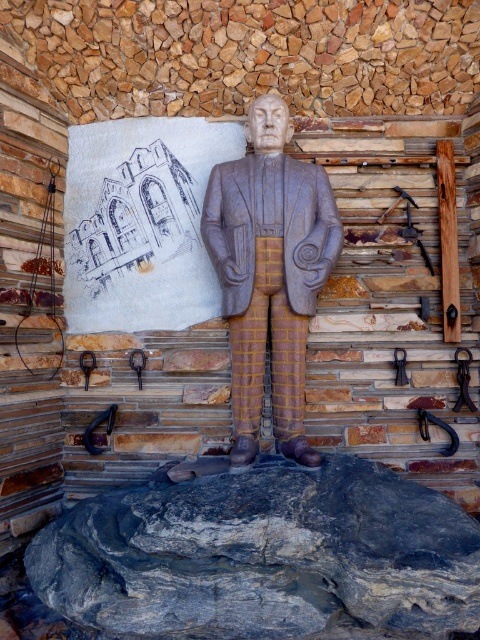
You are an art restorer examining the stone sculpture and the white sheet on the wall. You notice two points marked on the sculpture. Which point is nearer to you, point (x=276, y=394) or point (x=406, y=353)?

Point (x=276, y=394) is closer to the viewer than point (x=406, y=353).